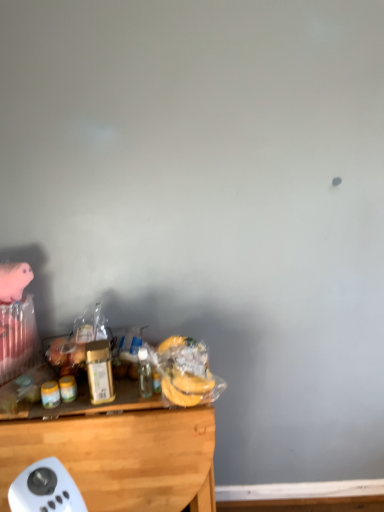
The height and width of the screenshot is (512, 384). I want to click on spots to the right of yellow matte jar at left, the 2th food viewed from the right, so pyautogui.click(x=102, y=398).